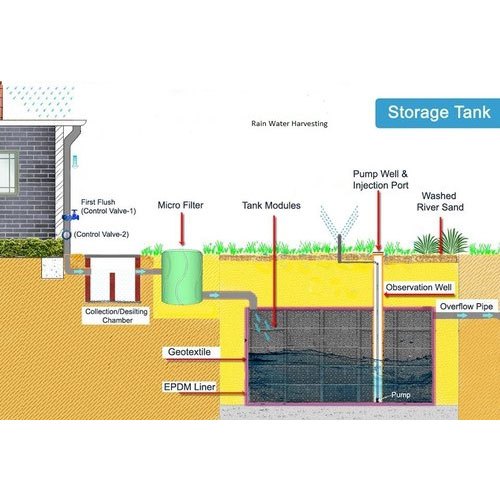
This screenshot has height=500, width=500. I want to click on chamber, so click(x=124, y=294).